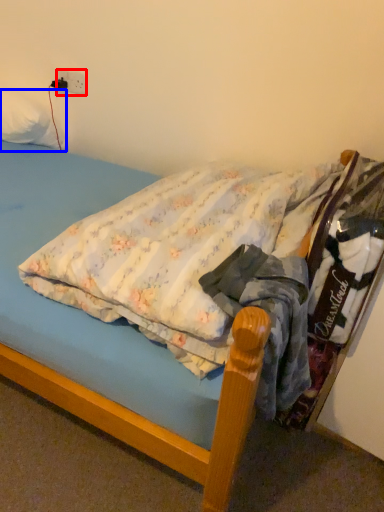
Question: Which point is closer to the camera, electric outlet (highlighted by a red box) or pillow (highlighted by a blue box)?

Choices:
 (A) electric outlet
 (B) pillow

Answer: (B)